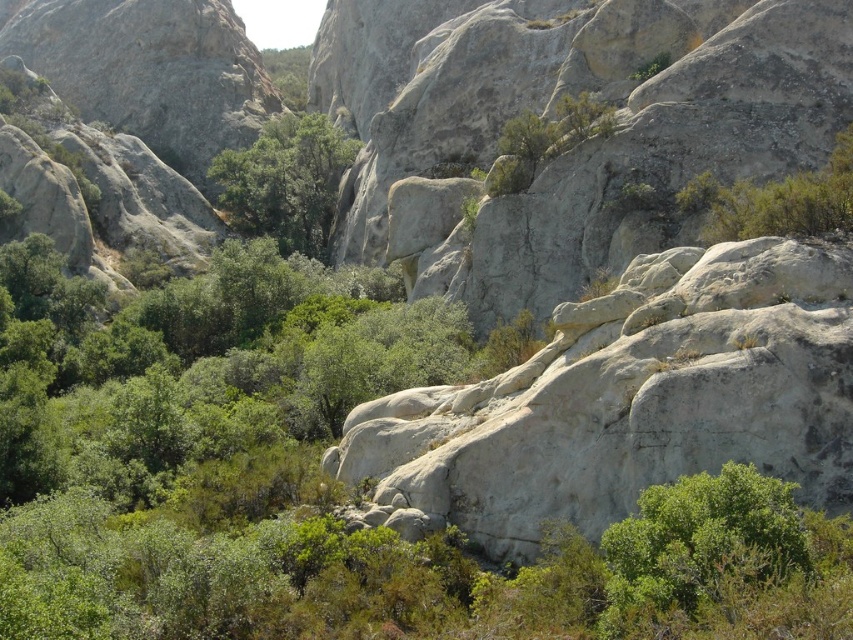
Question: Can you confirm if green leafy tree at center is thinner than green leafy shrub at upper right?

Choices:
 (A) yes
 (B) no

Answer: (B)

Question: Does green leafy tree at center appear under green leafy shrub at upper right?

Choices:
 (A) yes
 (B) no

Answer: (B)

Question: Is the position of green leafy tree at center more distant than that of green leafy shrub at upper right?

Choices:
 (A) yes
 (B) no

Answer: (A)

Question: Which point is farther to the camera?

Choices:
 (A) (252, 202)
 (B) (724, 204)

Answer: (A)

Question: Which point is farther to the camera?

Choices:
 (A) green leafy tree at center
 (B) green leafy shrub at upper right

Answer: (A)

Question: Which point is closer to the camera taking this photo?

Choices:
 (A) tap(258, 205)
 (B) tap(811, 192)

Answer: (B)